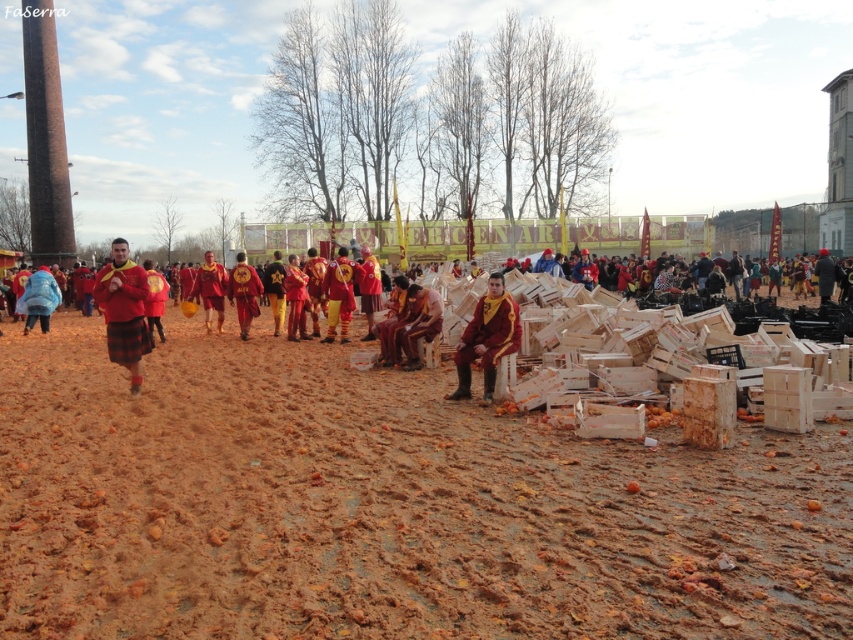
Looking at this image, can you confirm if matte red kilt at left is positioned above blue fabric jacket at left?

Yes, matte red kilt at left is above blue fabric jacket at left.

Who is more forward, [136,364] or [18,308]?

Point [136,364] is in front.

At what (x,y) coordinates should I click in order to perform the action: click on matte red kilt at left. Please return your answer as a coordinate pair (x, y). Looking at the image, I should click on (123, 310).

This screenshot has height=640, width=853. What do you see at coordinates (486, 339) in the screenshot? I see `matte yellow jacket at center` at bounding box center [486, 339].

Does matte yellow jacket at center have a lesser width compared to matte red and yellow uniform at center?

Incorrect, matte yellow jacket at center's width is not less than matte red and yellow uniform at center's.

Is point (480, 358) farther from viewer compared to point (340, 291)?

That is False.

Locate an element on the screen. Image resolution: width=853 pixels, height=640 pixels. matte yellow jacket at center is located at coordinates (486, 339).

Is shiny gold helmet at center to the left of shiny red fabric at center from the viewer's perspective?

Correct, you'll find shiny gold helmet at center to the left of shiny red fabric at center.

Who is positioned more to the right, shiny gold helmet at center or shiny red fabric at center?

shiny red fabric at center is more to the right.

In order to click on shiny gold helmet at center in this screenshot , I will do `click(244, 292)`.

Where is `shiny gold helmet at center`? The image size is (853, 640). shiny gold helmet at center is located at coordinates (244, 292).